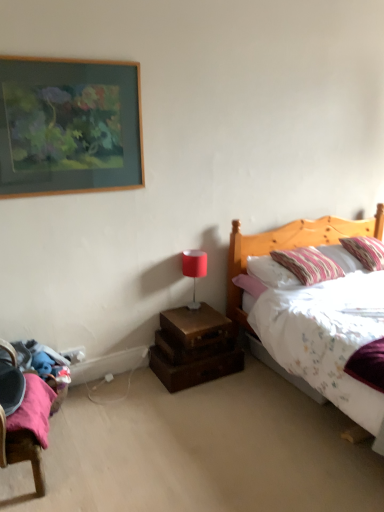
Question: Should I look upward or downward to see matte red lamp at center?

Choices:
 (A) up
 (B) down

Answer: (B)

Question: From the image's perspective, does striped fabric pillow at upper right, which ranks as the 1th pillow in right-to-left order, appear lower than wooden nightstand at lower center?

Choices:
 (A) no
 (B) yes

Answer: (A)

Question: Does striped fabric pillow at upper right, the second pillow viewed from the left, have a smaller size compared to wooden nightstand at lower center?

Choices:
 (A) no
 (B) yes

Answer: (A)

Question: Is the depth of striped fabric pillow at upper right, the second pillow viewed from the left, less than that of wooden nightstand at lower center?

Choices:
 (A) yes
 (B) no

Answer: (B)

Question: Can you confirm if striped fabric pillow at upper right, the second pillow viewed from the left, is thinner than wooden nightstand at lower center?

Choices:
 (A) no
 (B) yes

Answer: (A)

Question: Does striped fabric pillow at upper right, the second pillow viewed from the left, have a lesser height compared to wooden nightstand at lower center?

Choices:
 (A) no
 (B) yes

Answer: (A)

Question: Does striped fabric pillow at upper right, the second pillow viewed from the left, have a larger size compared to wooden nightstand at lower center?

Choices:
 (A) no
 (B) yes

Answer: (B)

Question: Would you consider wooden trunk at lower center to be distant from striped fabric pillow at upper right, the second pillow viewed from the left?

Choices:
 (A) yes
 (B) no

Answer: (A)

Question: Does wooden trunk at lower center have a greater height compared to striped fabric pillow at upper right, which ranks as the 1th pillow in right-to-left order?

Choices:
 (A) yes
 (B) no

Answer: (B)

Question: From a real-world perspective, is wooden trunk at lower center physically below striped fabric pillow at upper right, the second pillow viewed from the left?

Choices:
 (A) yes
 (B) no

Answer: (A)

Question: Does wooden trunk at lower center lie in front of striped fabric pillow at upper right, the second pillow viewed from the left?

Choices:
 (A) yes
 (B) no

Answer: (A)

Question: Is wooden trunk at lower center not within striped fabric pillow at upper right, which ranks as the 1th pillow in right-to-left order?

Choices:
 (A) yes
 (B) no

Answer: (A)

Question: Does wooden trunk at lower center have a greater width compared to striped fabric pillow at upper right, the second pillow viewed from the left?

Choices:
 (A) no
 (B) yes

Answer: (A)

Question: Are wooden nightstand at lower center and wooden picture frame at upper left making contact?

Choices:
 (A) yes
 (B) no

Answer: (B)